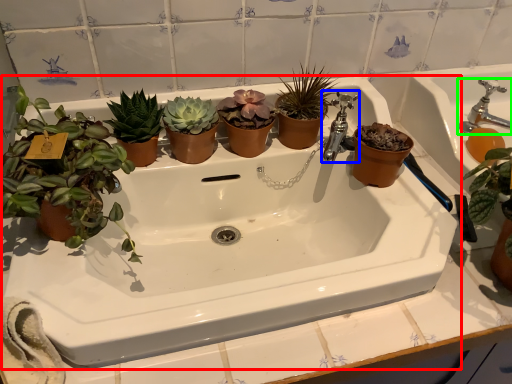
Question: Estimate the real-world distances between objects in this image. Which object is farther from sink (highlighted by a red box), tap (highlighted by a blue box) or tap (highlighted by a green box)?

Choices:
 (A) tap
 (B) tap

Answer: (B)